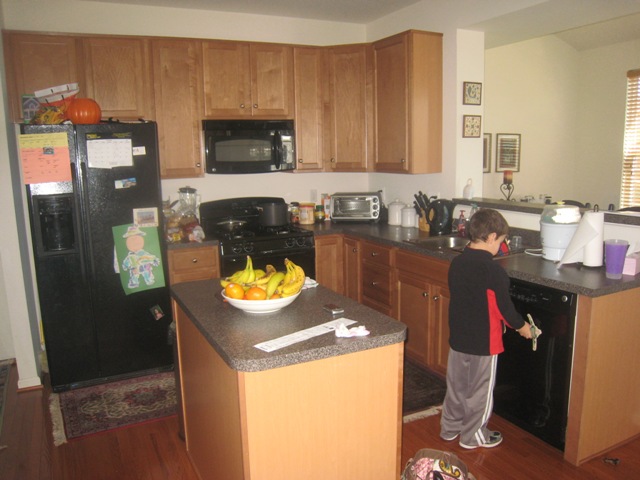
Locate an element on the screen. ceiling is located at coordinates (333, 9).